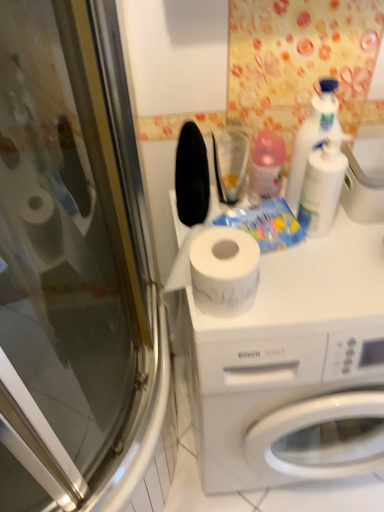
Question: Considering the relative positions of white plastic bottle at upper right, marked as the first cleaning product in a right-to-left arrangement, and transparent glass screen door at left in the image provided, is white plastic bottle at upper right, marked as the first cleaning product in a right-to-left arrangement, to the left or to the right of transparent glass screen door at left?

Choices:
 (A) right
 (B) left

Answer: (A)

Question: Is white plastic bottle at upper right, which is the 3th cleaning product in left-to-right order, taller or shorter than transparent glass screen door at left?

Choices:
 (A) tall
 (B) short

Answer: (B)

Question: Which object is positioned farthest from the transparent glass screen door at left?

Choices:
 (A) white plastic bottle at upper right, which is the 3th cleaning product in left-to-right order
 (B) white plastic soap dispenser at upper right
 (C) pink plastic bottle at upper center, the third cleaning product when ordered from right to left
 (D) white plastic bottle at upper right, which appears as the 2th cleaning product when viewed from the right
 (E) white matte washing machine at center

Answer: (B)

Question: Considering the real-world distances, which object is farthest from the white plastic bottle at upper right, the second cleaning product viewed from the left?

Choices:
 (A) transparent glass screen door at left
 (B) pink plastic bottle at upper center, the third cleaning product when ordered from right to left
 (C) white plastic soap dispenser at upper right
 (D) white plastic bottle at upper right, marked as the first cleaning product in a right-to-left arrangement
 (E) white matte washing machine at center

Answer: (A)